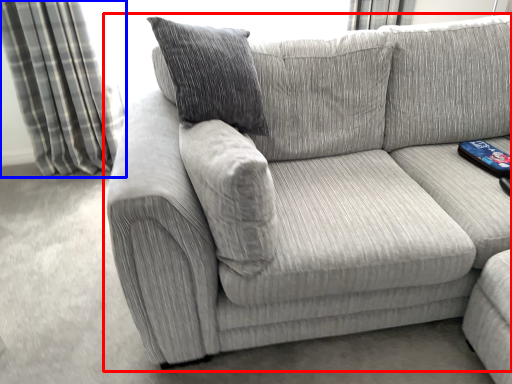
Question: Which object appears farthest to the camera in this image, studio couch (highlighted by a red box) or curtain (highlighted by a blue box)?

Choices:
 (A) studio couch
 (B) curtain

Answer: (B)